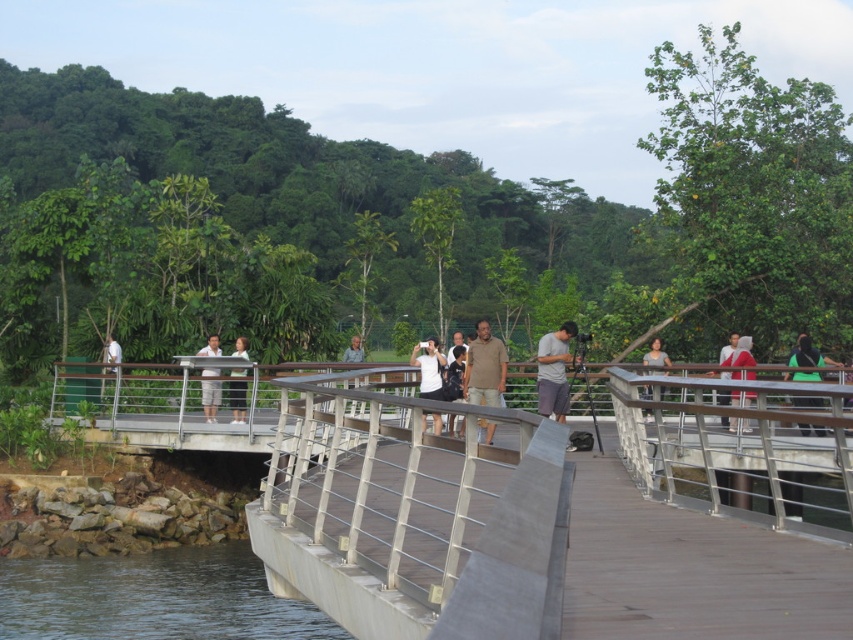
You are standing on the pedestrian bridge and want to find a spot where you can see both the water and the shaded area on the left. The gray cotton tshirt at center is worn by a person facing the water. Is the point at coordinate (x=554, y=371) on the gray cotton tshirt at center a good vantage point for this view?

The point at coordinate (x=554, y=371) is on the gray cotton tshirt at center, which is worn by a person facing the water. Since the shaded area is on the left side of the image, the person would need to turn to their left to see it while still facing the water. This position allows them to view both areas simultaneously, making it a suitable vantage point.

You are a tour guide leading a group on the bridge. You notice two tourists wearing the white matte shirt at center and the matte gray shirt at center. The bridge has a 6 meter safety rule between visitors to ensure everyone can move comfortably. Can these two tourists safely stay at their current positions according to the rule?

The distance between the white matte shirt at center and matte gray shirt at center is 5.64 meters. Since the safety rule requires 6 meters, they are slightly too close and should move further apart to comply with the 6 meter requirement.